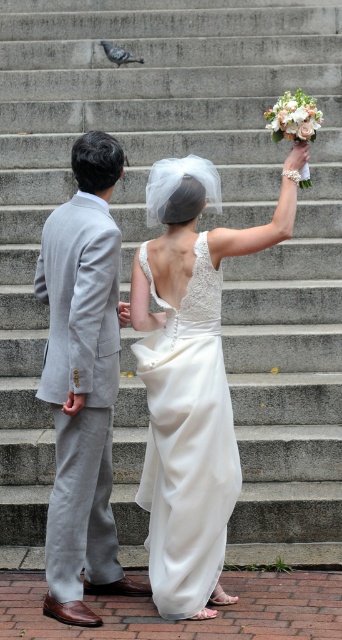
You are a photographer at the wedding. You need to adjust the lighting so that both the light gray suit at left and the white lace dress at center are evenly illuminated. Based on their positions, which one might need more light? Explain your reasoning.

The light gray suit at left is located above the white lace dress at center. Since it is higher up, it might be in a different lighting zone. If the existing light source is below them, the upper part could be in shadow, requiring more light. Alternatively, if the light is above, the higher position might already be well lit. The photographer should check the current lighting direction to determine where additional light is needed.

Please describe the object located at the coordinates point (83, 381) in the image.

The object at point (83, 381) is the light gray suit at left.